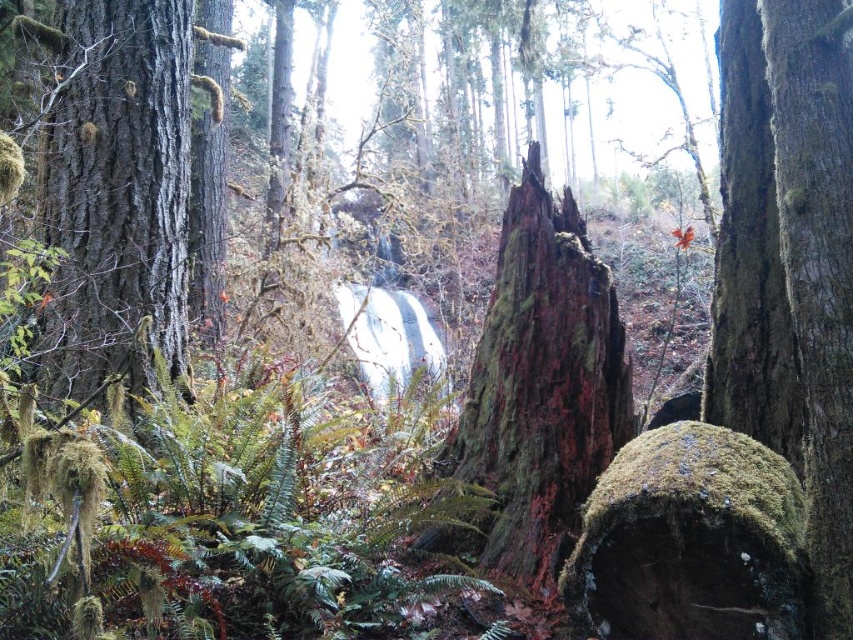
You are a hiker trying to navigate through the forest. You see the green mossy tree trunk at center and the green mossy boulder at center. Which one should you avoid stepping on if you want to stay on the path?

You should avoid stepping on the green mossy boulder at center because the green mossy tree trunk at center is to the left of it, so the boulder is likely blocking the path.

You are an explorer navigating through the forest. You see the green mossy boulder at center and the green mossy bark at right. Which one is positioned more to the left side of the scene?

The green mossy boulder at center is positioned more to the left side of the scene than the green mossy bark at right.